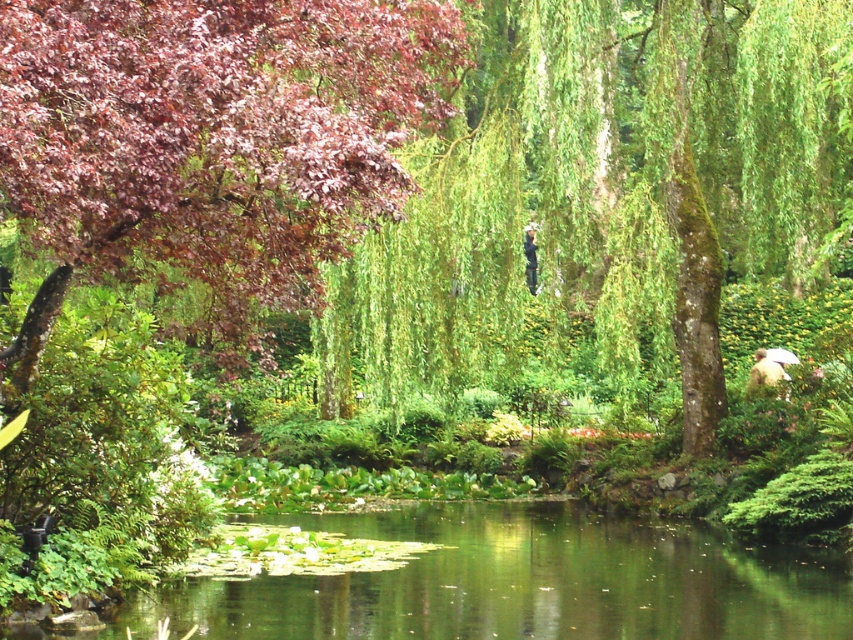
Question: Which point is closer to the camera taking this photo?

Choices:
 (A) (764, 385)
 (B) (552, 316)

Answer: (B)

Question: Among these points, which one is farthest from the camera?

Choices:
 (A) (776, 371)
 (B) (558, 193)
 (C) (531, 257)
 (D) (351, 516)

Answer: (A)

Question: Can you confirm if green liquid water at center is wider than camouflage jacket at lower right?

Choices:
 (A) yes
 (B) no

Answer: (A)

Question: Can you confirm if green leafy willow at center is wider than green liquid water at center?

Choices:
 (A) no
 (B) yes

Answer: (B)

Question: Is green liquid water at center wider than dark blue fabric at center?

Choices:
 (A) no
 (B) yes

Answer: (B)

Question: Which of these objects is positioned closest to the green liquid water at center?

Choices:
 (A) camouflage jacket at lower right
 (B) dark blue fabric at center
 (C) green leafy willow at center

Answer: (C)